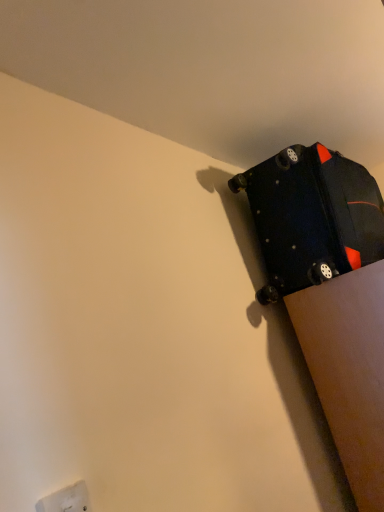
Question: From the image's perspective, is white plastic electric outlet at lower left positioned above or below matte black suitcase at upper right?

Choices:
 (A) above
 (B) below

Answer: (B)

Question: From a real-world perspective, is white plastic electric outlet at lower left above or below matte black suitcase at upper right?

Choices:
 (A) above
 (B) below

Answer: (B)

Question: Based on their positions, is white plastic electric outlet at lower left located to the left or right of matte black suitcase at upper right?

Choices:
 (A) left
 (B) right

Answer: (A)

Question: Visually, is matte black suitcase at upper right positioned to the left or to the right of white plastic electric outlet at lower left?

Choices:
 (A) right
 (B) left

Answer: (A)

Question: Is point (274, 230) positioned closer to the camera than point (54, 510)?

Choices:
 (A) farther
 (B) closer

Answer: (A)

Question: From the image's perspective, relative to white plastic electric outlet at lower left, is matte black suitcase at upper right above or below?

Choices:
 (A) above
 (B) below

Answer: (A)

Question: From a real-world perspective, is matte black suitcase at upper right physically located above or below white plastic electric outlet at lower left?

Choices:
 (A) above
 (B) below

Answer: (A)